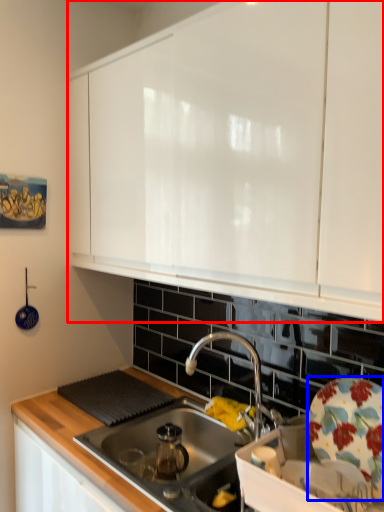
Question: Which object appears closest to the camera in this image, cabinetry (highlighted by a red box) or plate (highlighted by a blue box)?

Choices:
 (A) cabinetry
 (B) plate

Answer: (A)